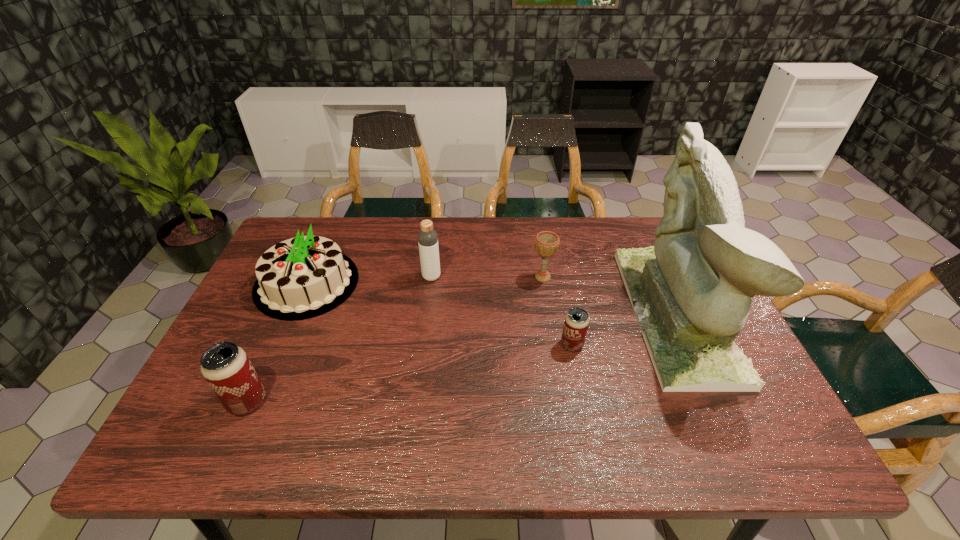
The width and height of the screenshot is (960, 540). Find the location of `the taller beer can`. the taller beer can is located at coordinates (226, 367).

Where is `the left beer can`? the left beer can is located at coordinates (226, 367).

At what (x,y) coordinates should I click in order to perform the action: click on the shorter beer can. Please return your answer as a coordinate pair (x, y). Looking at the image, I should click on (576, 323).

Where is `the right beer can`? This screenshot has height=540, width=960. the right beer can is located at coordinates (576, 323).

Find the location of a particular element. chalice is located at coordinates (547, 243).

You are a GUI agent. You are given a task and a screenshot of the screen. Output one action in this format:
    pyautogui.click(x=<x>, y=<y>)
    Task: Click on the rightmost object
    The image size is (960, 540).
    Given the screenshot: What is the action you would take?
    pyautogui.click(x=691, y=292)

Find the location of a particular element. sculpture is located at coordinates (691, 292).

Find the location of a particular element. birthday cake is located at coordinates (300, 278).

Image resolution: width=960 pixels, height=540 pixels. I want to click on bottle, so [x=427, y=237].

Locate an element on the screen. Image resolution: width=960 pixels, height=540 pixels. free region located on the right of the left beer can is located at coordinates (398, 401).